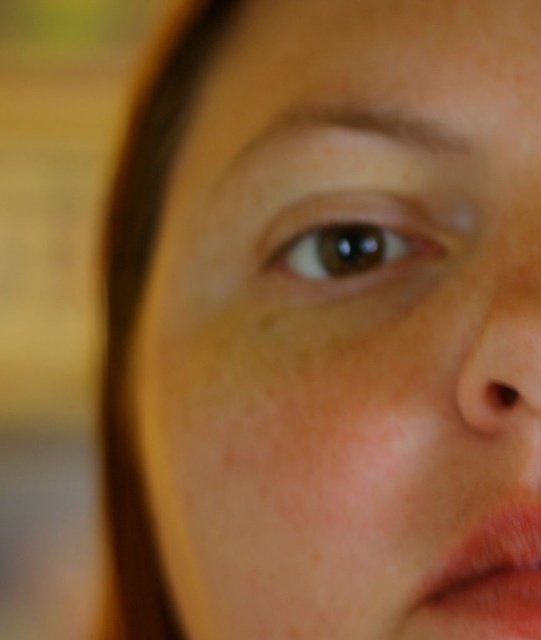
Question: Which of the following is the farthest from the observer?

Choices:
 (A) pink matte lips at lower right
 (B) smooth skin nose at right

Answer: (A)

Question: Which point is closer to the camera?

Choices:
 (A) pink matte lips at lower right
 (B) smooth skin nose at right

Answer: (B)

Question: Can you confirm if pink matte lips at lower right is smaller than smooth skin nose at right?

Choices:
 (A) yes
 (B) no

Answer: (B)

Question: From the image, what is the correct spatial relationship of pink matte lips at lower right in relation to smooth skin nose at right?

Choices:
 (A) right
 (B) left

Answer: (B)

Question: Considering the relative positions of pink matte lips at lower right and smooth skin nose at right in the image provided, where is pink matte lips at lower right located with respect to smooth skin nose at right?

Choices:
 (A) right
 (B) left

Answer: (B)